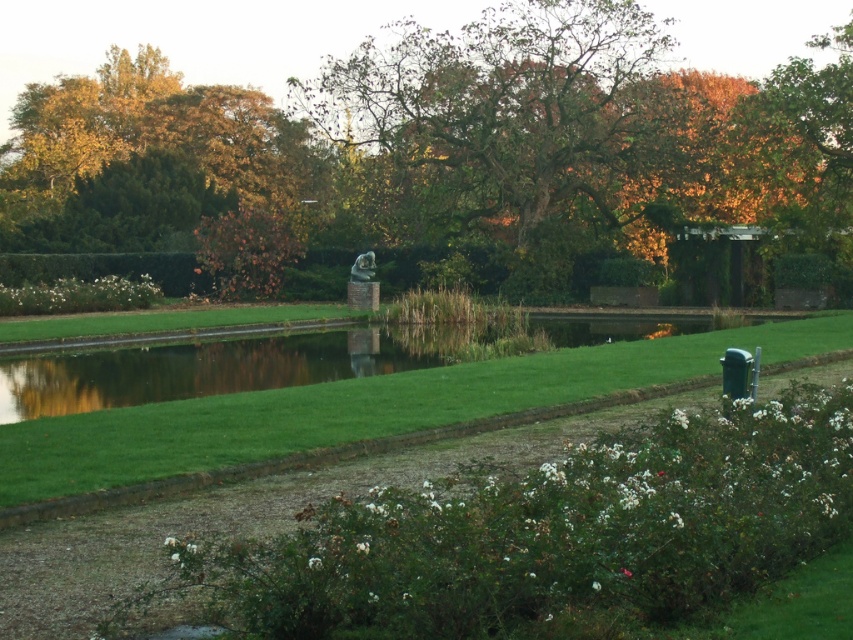
You are planning to take a photo of the green grass at center and golden foliage at upper left. Which object is closer to the camera? Please explain based on their positions.

The green grass at center is positioned under the golden foliage at upper left, which means the golden foliage at upper left is closer to the camera.